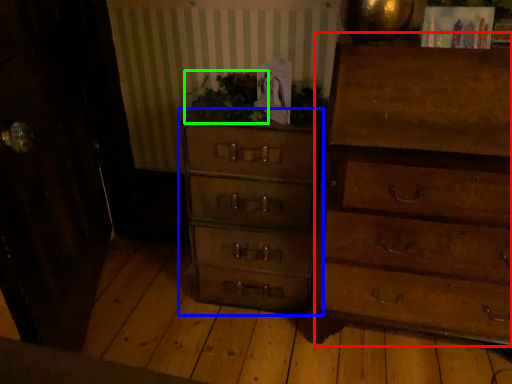
Question: Estimate the real-world distances between objects in this image. Which object is farther from chest of drawers (highlighted by a red box), chest of drawers (highlighted by a blue box) or houseplant (highlighted by a green box)?

Choices:
 (A) chest of drawers
 (B) houseplant

Answer: (B)